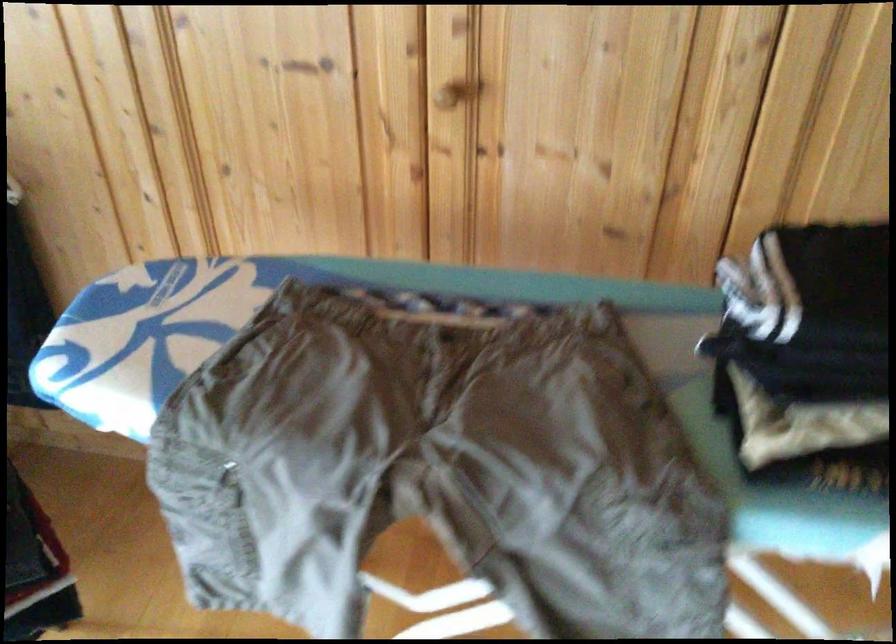
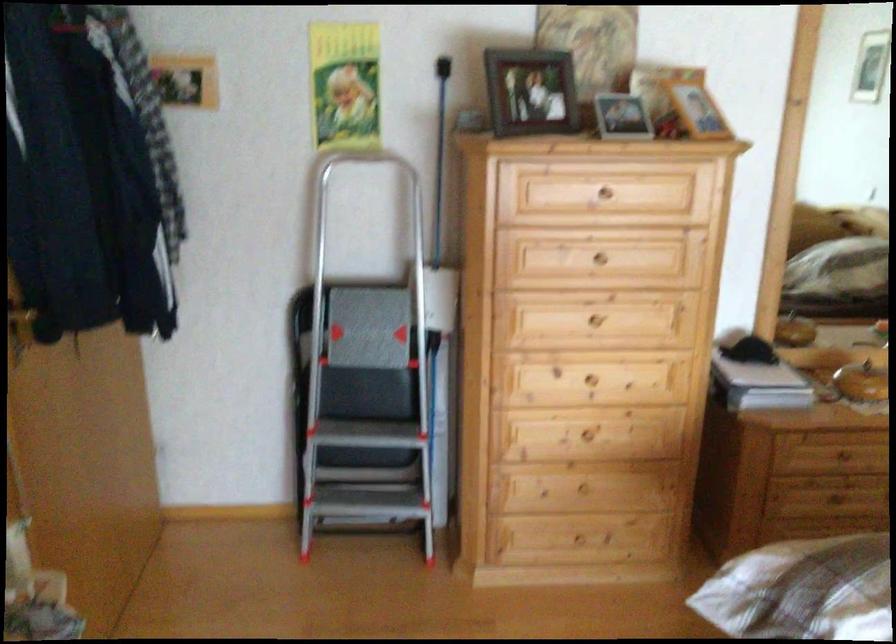
How did the camera likely rotate?

The camera rotated toward right-down.